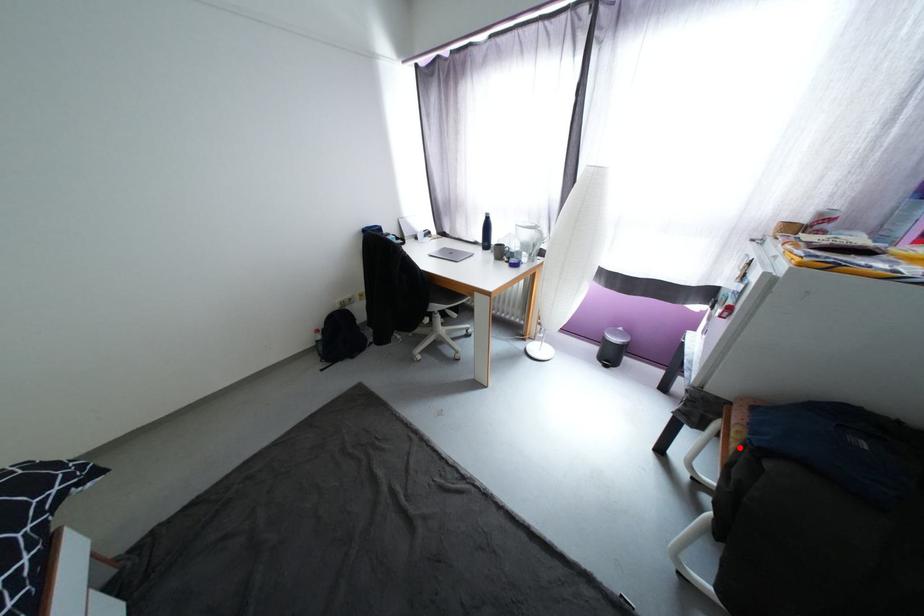
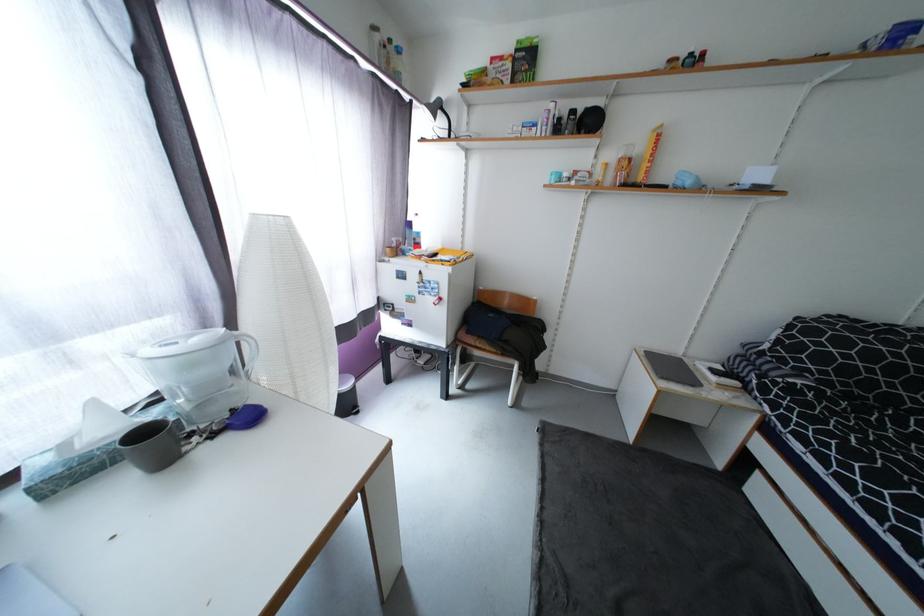
Locate, in the second image, the point that corresponds to the highlighted location in the first image.

(493, 349)